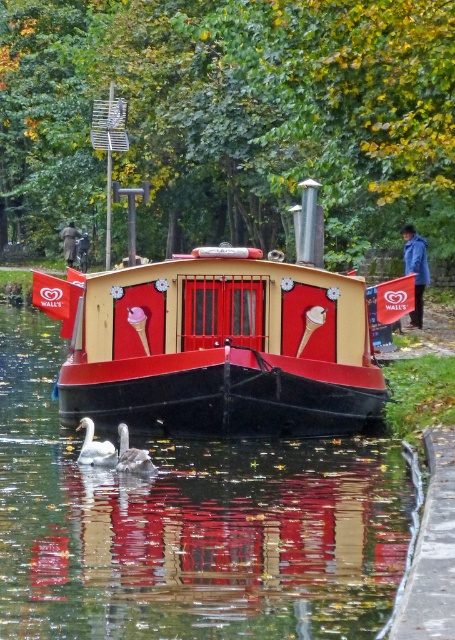
You are a fashion designer observing the jackets on the narrowboat. Which jacket is wider, the blue fabric jacket at right or the dark brown leather jacket at center?

The dark brown leather jacket at center is wider than the blue fabric jacket at right.

You are a photographer trying to capture the reflection of the boat in the water. You need to know which area is wider between the smooth black water at center and the white matte duck at lower center to frame your shot properly. Which one is wider?

The smooth black water at center is wider than the white matte duck at lower center, so you should focus on the smooth black water at center for a wider reflection.